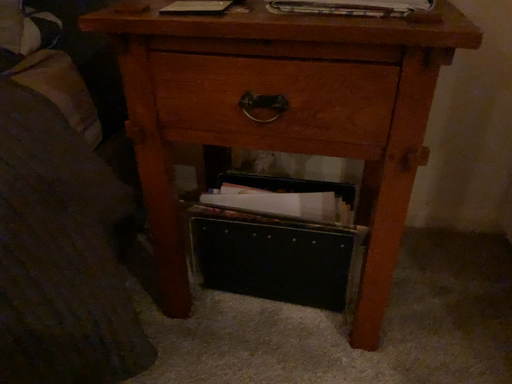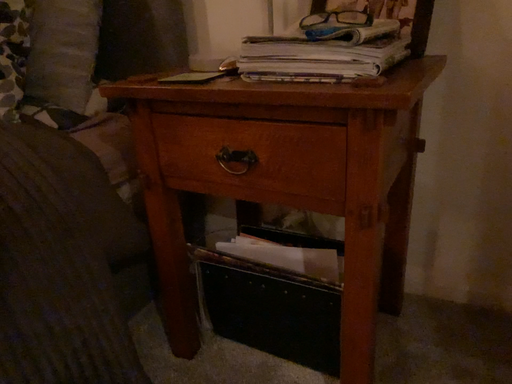
Question: How did the camera likely rotate when shooting the video?

Choices:
 (A) rotated left
 (B) rotated right

Answer: (A)